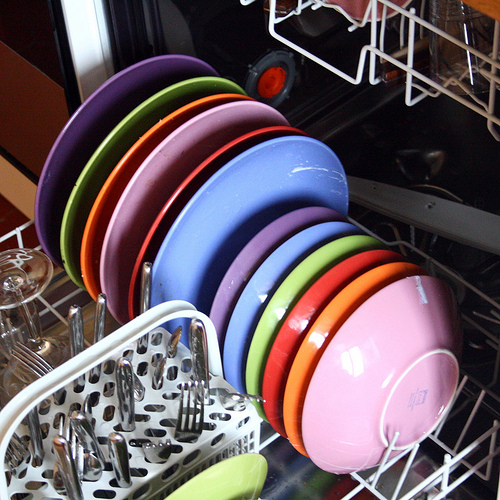
The image size is (500, 500). I want to click on silverware handle, so click(x=116, y=451), click(x=87, y=429), click(x=66, y=462), click(x=119, y=394), click(x=206, y=351), click(x=145, y=280), click(x=102, y=320), click(x=79, y=327).